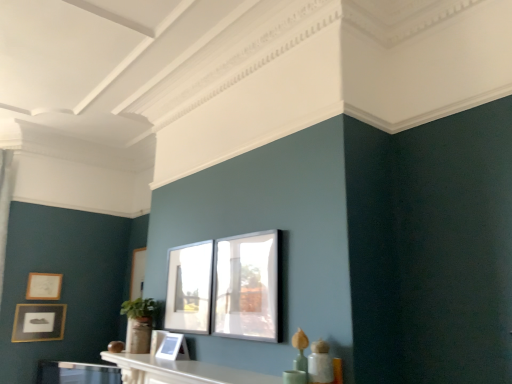
Question: Would you say matte gold picture frame at lower left, which is counted as the second picture frame, starting from the back, is outside clear glass window at center?

Choices:
 (A) no
 (B) yes

Answer: (B)

Question: Can you confirm if matte gold picture frame at lower left, which is the fourth picture frame from right to left, is thinner than clear glass window at center?

Choices:
 (A) yes
 (B) no

Answer: (B)

Question: Could you tell me if matte gold picture frame at lower left, which is counted as the second picture frame, starting from the back, is facing clear glass window at center?

Choices:
 (A) no
 (B) yes

Answer: (B)

Question: Does matte gold picture frame at lower left, which is counted as the second picture frame, starting from the back, have a greater height compared to clear glass window at center?

Choices:
 (A) yes
 (B) no

Answer: (B)

Question: Is matte gold picture frame at lower left, which ranks as the 1th picture frame in left-to-right order, looking in the opposite direction of clear glass window at center?

Choices:
 (A) no
 (B) yes

Answer: (A)

Question: From a real-world perspective, is matte glass picture frame at center, which is the fourth picture frame in back-to-front order, physically located above or below matte gold picture frame at left, the first picture frame viewed from the back?

Choices:
 (A) below
 (B) above

Answer: (A)

Question: Is matte glass picture frame at center, arranged as the 1th picture frame when viewed from the front, taller or shorter than matte gold picture frame at left, the first picture frame viewed from the back?

Choices:
 (A) tall
 (B) short

Answer: (A)

Question: Would you say matte glass picture frame at center, which appears as the 1th picture frame when viewed from the right, is to the left or to the right of matte gold picture frame at left, the first picture frame viewed from the back, in the picture?

Choices:
 (A) right
 (B) left

Answer: (A)

Question: Do you think matte glass picture frame at center, placed as the fourth picture frame when sorted from left to right, is within matte gold picture frame at left, the second picture frame when ordered from left to right, or outside of it?

Choices:
 (A) outside
 (B) inside

Answer: (A)

Question: Based on their sizes in the image, would you say clear glass window at center is bigger or smaller than matte glass picture frame at center, arranged as the 1th picture frame when viewed from the front?

Choices:
 (A) big
 (B) small

Answer: (B)

Question: Considering the relative positions of clear glass window at center and matte glass picture frame at center, which appears as the 1th picture frame when viewed from the right, in the image provided, is clear glass window at center to the left or to the right of matte glass picture frame at center, which appears as the 1th picture frame when viewed from the right,?

Choices:
 (A) right
 (B) left

Answer: (B)

Question: From the image's perspective, is clear glass window at center positioned above or below matte glass picture frame at center, which appears as the 1th picture frame when viewed from the right?

Choices:
 (A) above
 (B) below

Answer: (B)

Question: In terms of width, does clear glass window at center look wider or thinner when compared to matte glass picture frame at center, which is the fourth picture frame in back-to-front order?

Choices:
 (A) thin
 (B) wide

Answer: (A)

Question: Is matte gold picture frame at left, the second picture frame when ordered from left to right, bigger or smaller than clear glass window at center?

Choices:
 (A) small
 (B) big

Answer: (A)

Question: Does point (46, 289) appear closer or farther from the camera than point (166, 306)?

Choices:
 (A) farther
 (B) closer

Answer: (A)